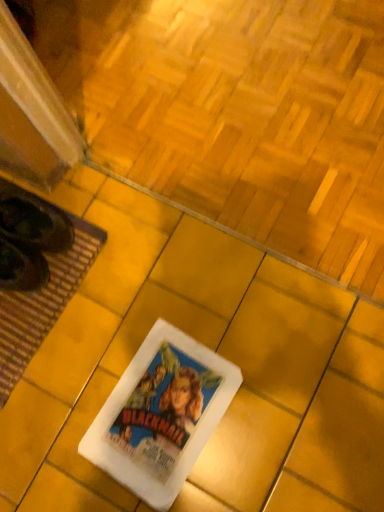
Question: From the image's perspective, is white paper at center located above or below white paper movie poster at center?

Choices:
 (A) above
 (B) below

Answer: (A)

Question: Considering their positions, is white paper at center located in front of or behind white paper movie poster at center?

Choices:
 (A) behind
 (B) front

Answer: (A)

Question: Which of these objects is positioned farthest from the brown woven mat at lower left?

Choices:
 (A) white paper movie poster at center
 (B) white paper at center

Answer: (B)

Question: Based on their relative distances, which object is farther from the white paper movie poster at center?

Choices:
 (A) white paper at center
 (B) brown woven mat at lower left

Answer: (A)